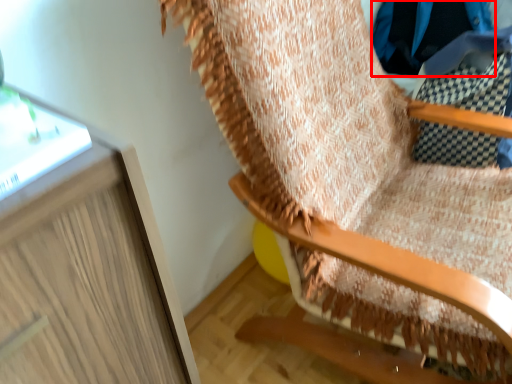
Question: In this image, where is clothing (annotated by the red box) located relative to furniture?

Choices:
 (A) right
 (B) left

Answer: (A)